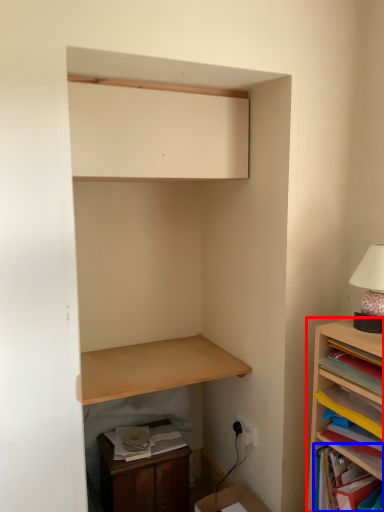
Question: Which of the following is the farthest to the observer, shelf (highlighted by a red box) or shelf (highlighted by a blue box)?

Choices:
 (A) shelf
 (B) shelf

Answer: (B)